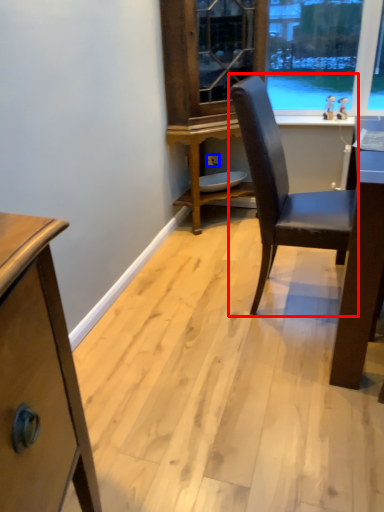
Question: Among these objects, which one is nearest to the camera, chair (highlighted by a red box) or power outlet (highlighted by a blue box)?

Choices:
 (A) chair
 (B) power outlet

Answer: (A)